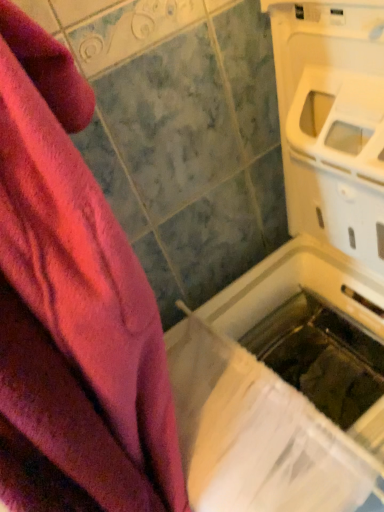
Question: Should I look upward or downward to see white plastic washing machine at upper right?

Choices:
 (A) up
 (B) down

Answer: (B)